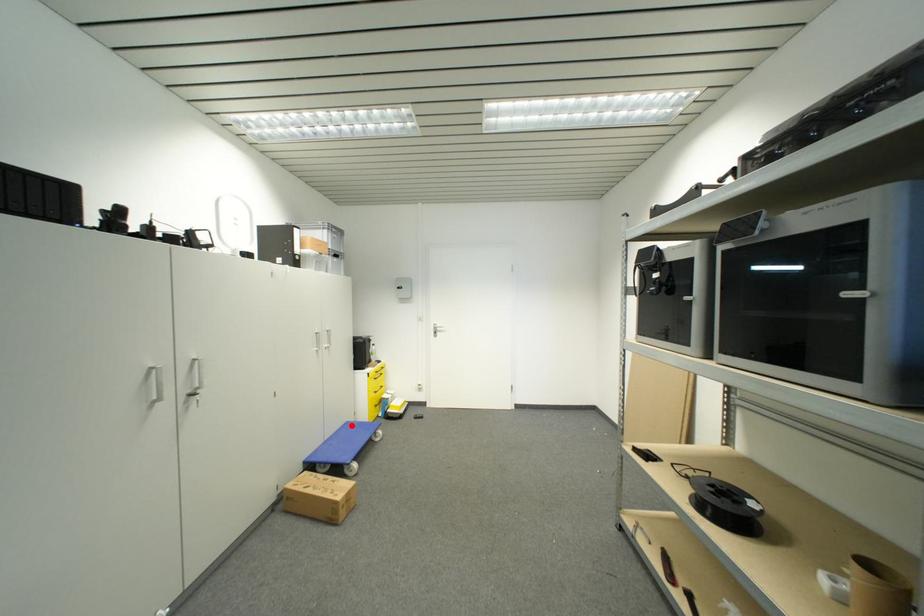
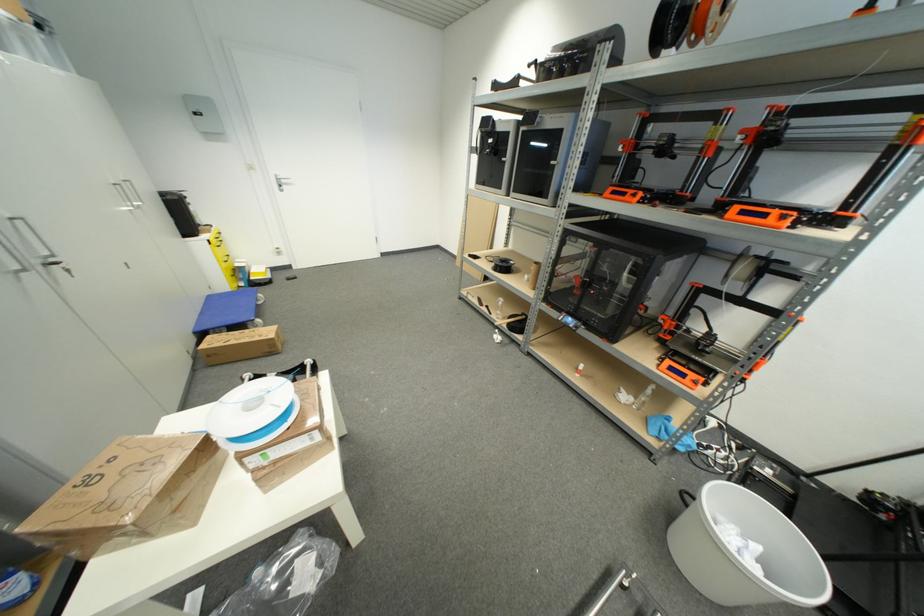
Question: I am providing you with two images of the same scene from different viewpoints. Given a red point in image1, look at the same physical point in image2. Is it:

Choices:
 (A) Closer to the viewpoint
 (B) Farther from the viewpoint

Answer: (A)